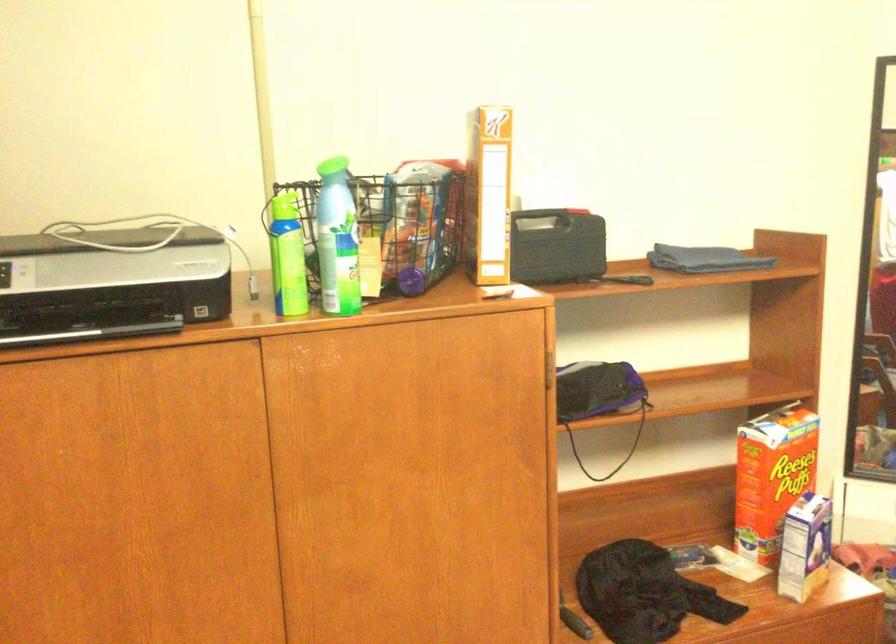
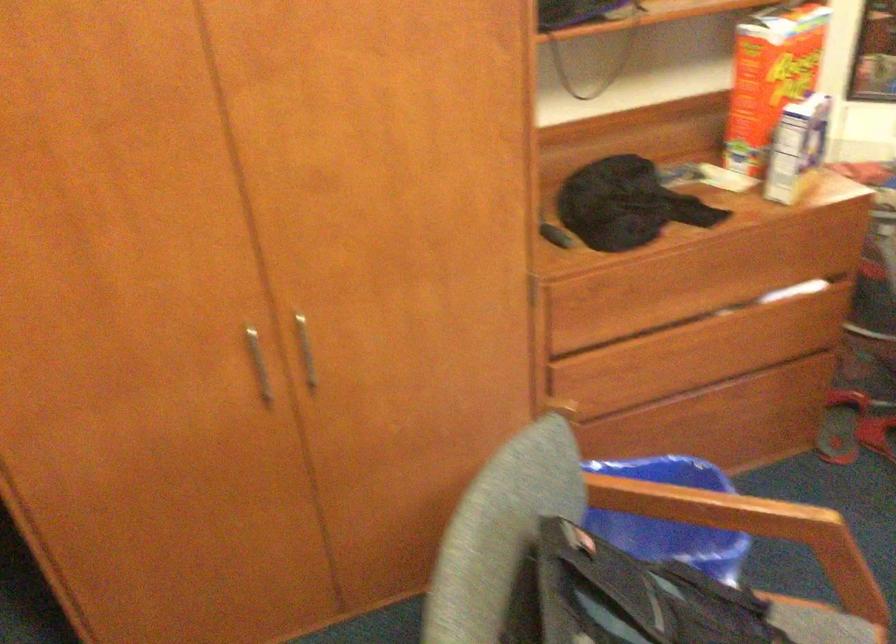
Question: The first image is from the beginning of the video and the second image is from the end. How did the camera likely rotate when shooting the video?

Choices:
 (A) Left
 (B) Right
 (C) Up
 (D) Down

Answer: (D)